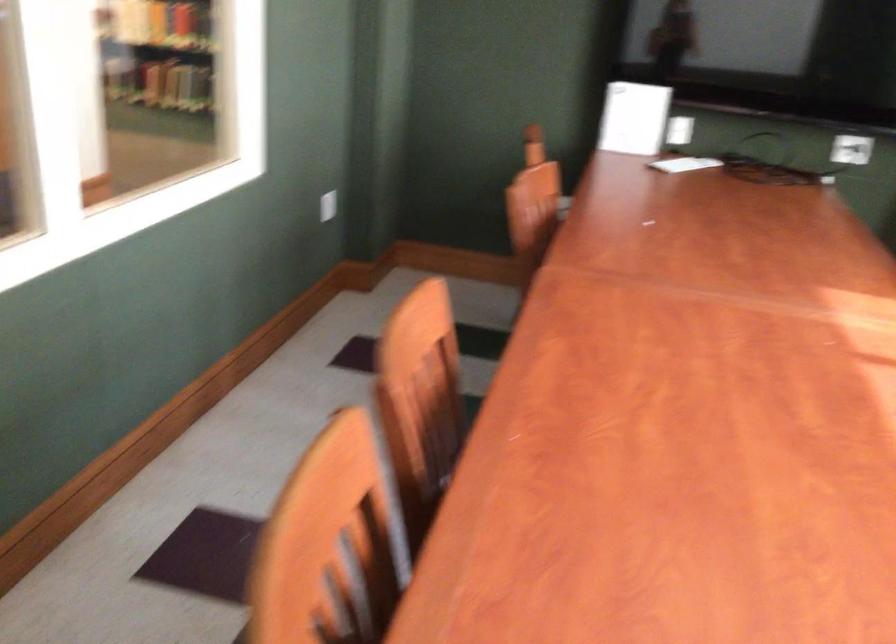
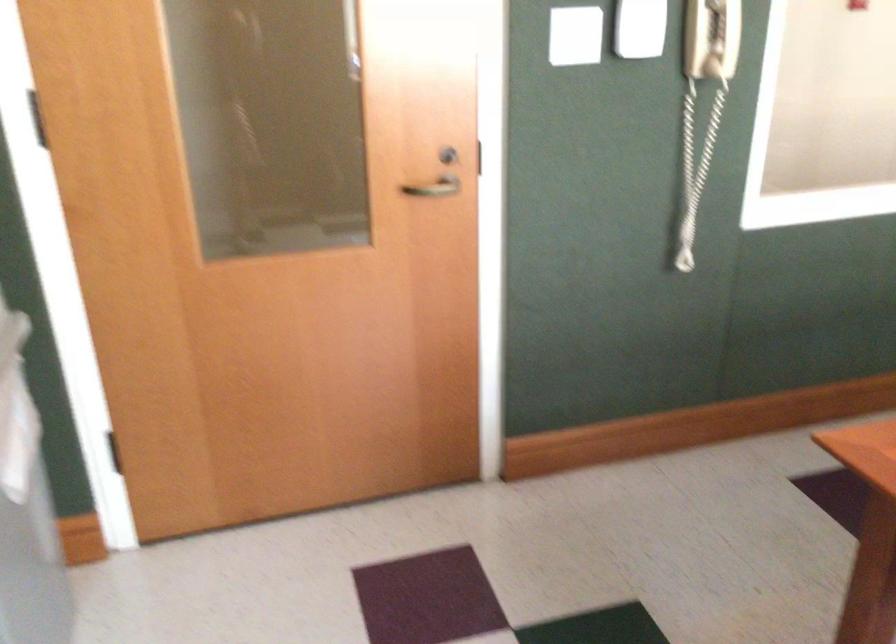
Question: How did the camera likely rotate?

Choices:
 (A) Left
 (B) Right
 (C) Up
 (D) Down

Answer: (A)